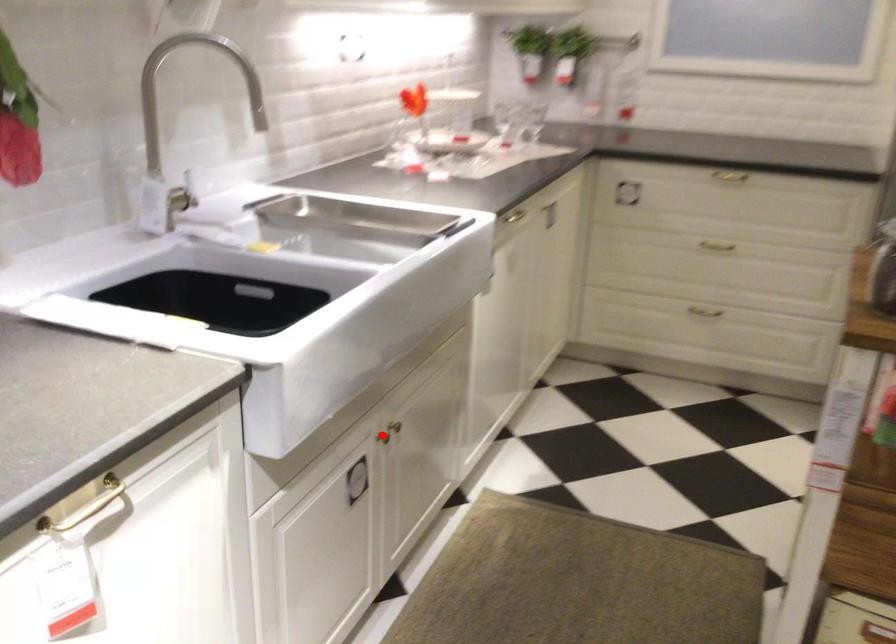
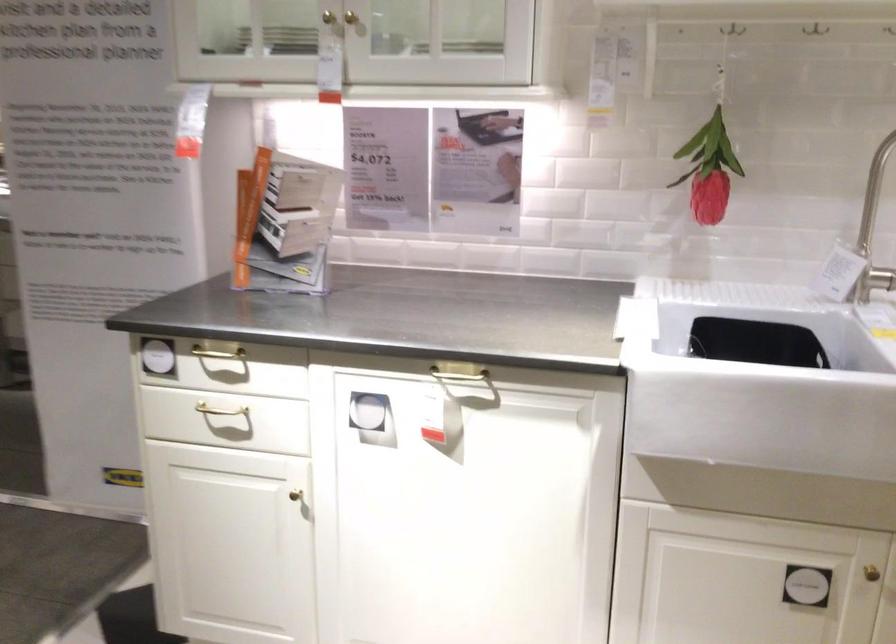
Question: I am providing you with two images of the same scene from different viewpoints. Given a red point in image1, look at the same physical point in image2. Is it:

Choices:
 (A) Closer to the viewpoint
 (B) Farther from the viewpoint

Answer: (A)